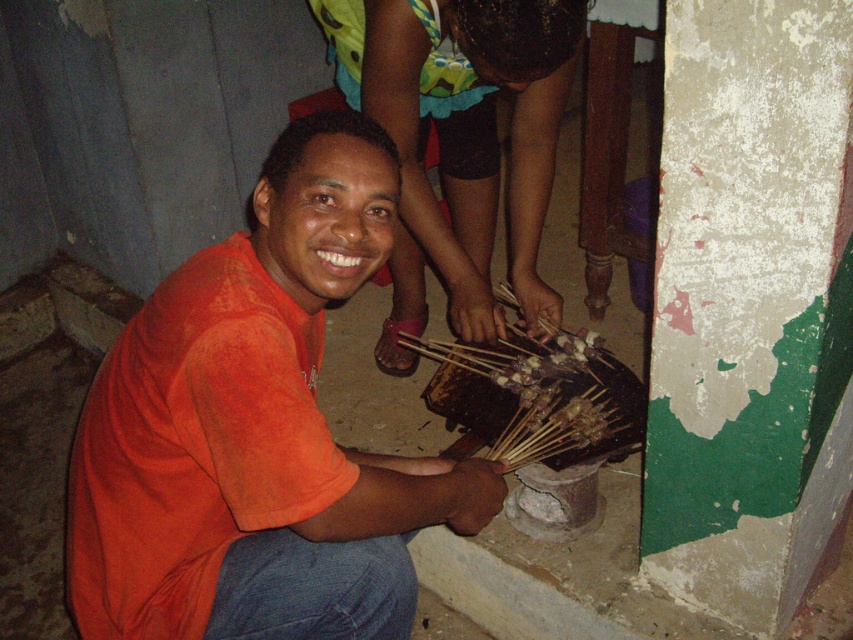
Does orange cotton shirt at center lie behind orange matte shirt at center?

No, orange cotton shirt at center is closer to the viewer.

Between point (196, 296) and point (534, 108), which one is positioned in front?

Point (196, 296)

Where is `orange cotton shirt at center`? Image resolution: width=853 pixels, height=640 pixels. orange cotton shirt at center is located at coordinates (256, 432).